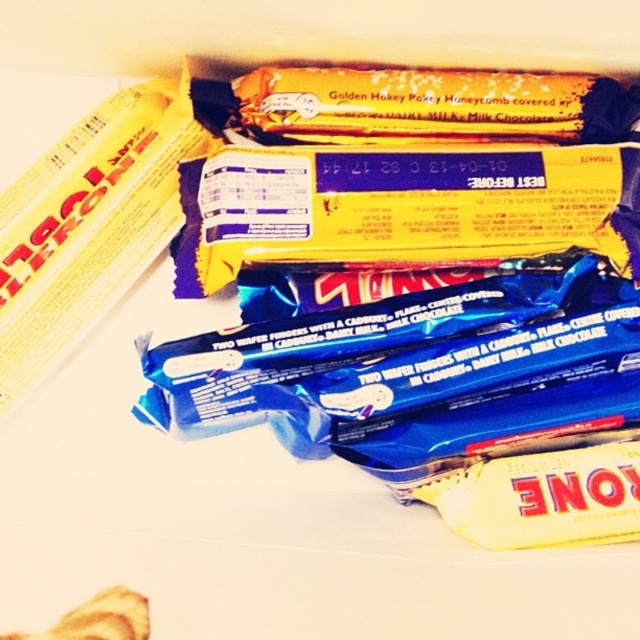
Is yellow matte chocolate bar at center above golden honeycomb at upper center?

Yes.

In the scene shown: Can you confirm if yellow matte chocolate bar at center is wider than golden honeycomb at upper center?

Correct, the width of yellow matte chocolate bar at center exceeds that of golden honeycomb at upper center.

Is point (529, 76) behind point (122, 621)?

Yes, it is behind point (122, 621).

The image size is (640, 640). Find the location of `yellow matte chocolate bar at center`. yellow matte chocolate bar at center is located at coordinates (432, 106).